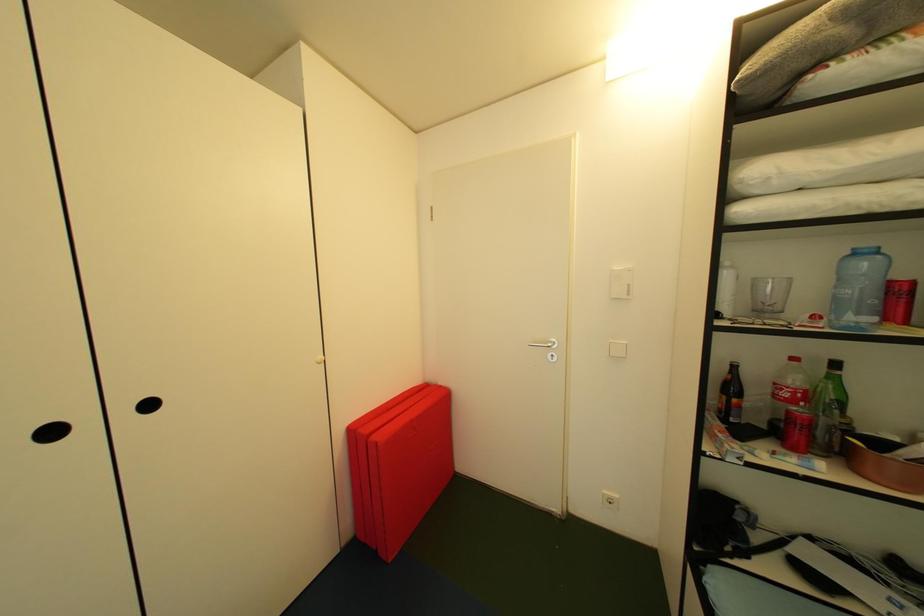
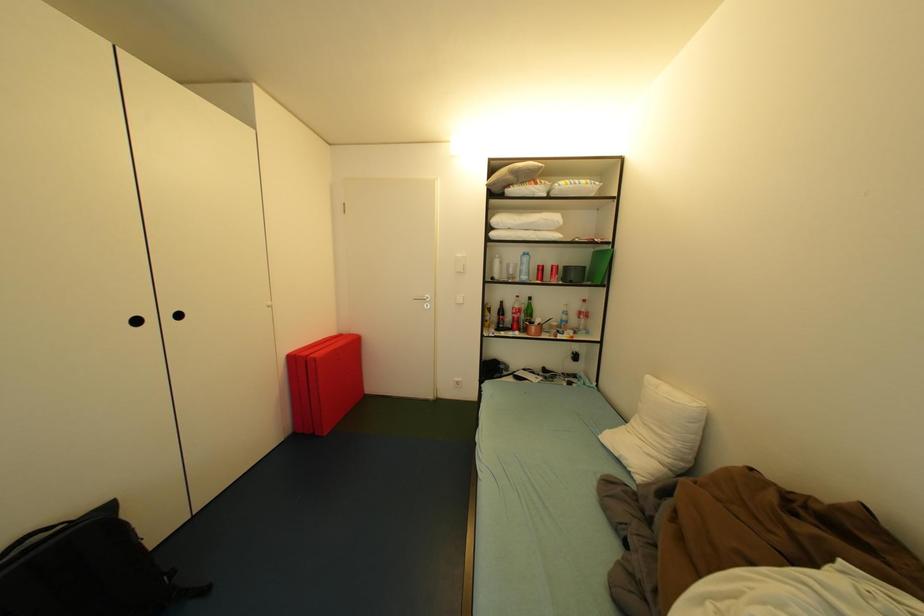
Question: Which direction would the cameraman need to move to produce the second image? Reply with the corresponding letter.

Choices:
 (A) Left
 (B) Right
 (C) Forward
 (D) Backward

Answer: (D)